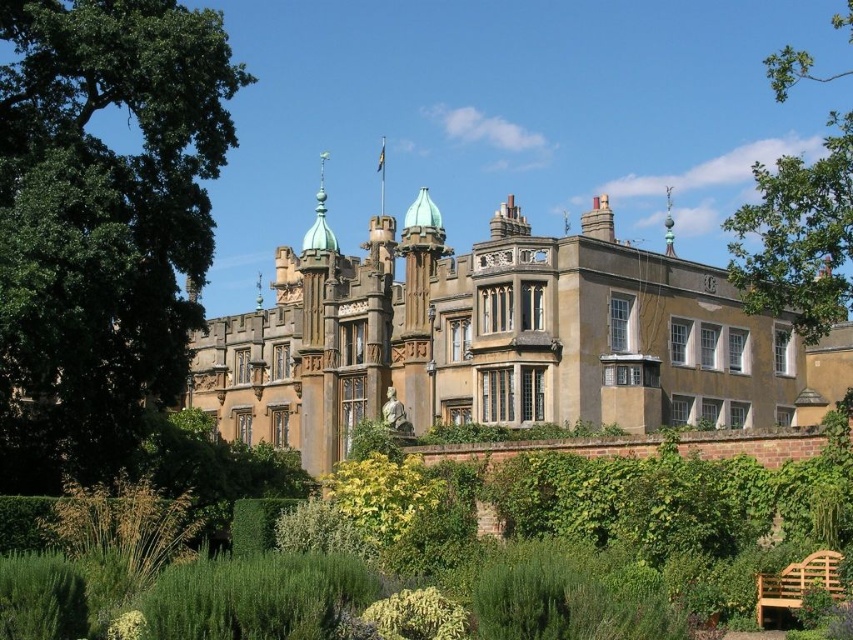
Question: Which point is farther to the camera?

Choices:
 (A) light brown wooden bench at lower right
 (B) green leafy hedge at center

Answer: (A)

Question: Can you confirm if green leafy hedge at center is bigger than light brown wooden bench at lower right?

Choices:
 (A) no
 (B) yes

Answer: (B)

Question: Is green leafy hedge at center to the right of light brown wooden bench at lower right from the viewer's perspective?

Choices:
 (A) yes
 (B) no

Answer: (B)

Question: Which of the following is the farthest from the observer?

Choices:
 (A) (781, 602)
 (B) (399, 310)
 (C) (637, 464)

Answer: (B)

Question: Is golden stone palace at center to the left of green leafy hedge at center from the viewer's perspective?

Choices:
 (A) no
 (B) yes

Answer: (A)

Question: Which object is the farthest from the light brown wooden bench at lower right?

Choices:
 (A) green leafy hedge at center
 (B) golden stone palace at center

Answer: (B)